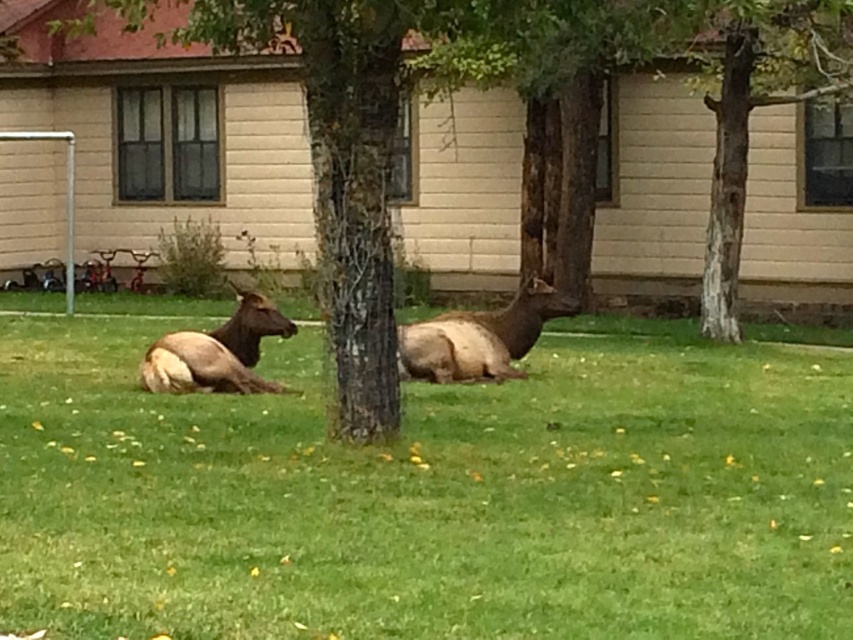
You are standing in the middle of the lawn and want to take a photo of the green bark tree at center. Which direction should you face to ensure the tree is in the frame?

The green bark tree at center is located at point coordinates of (525, 125), so you should face towards the center of the image to capture it in your photo.

You are standing in the garden and want to walk from the white textured bark at center to the brown furry deer at left. Which direction should you move to reach the deer?

You should move towards the brown furry deer at left because it is closer to you than the white textured bark at center, which is further away.